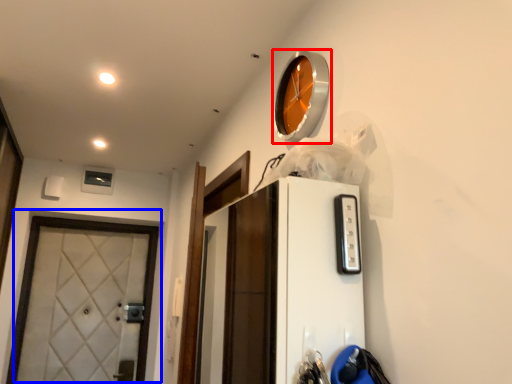
Question: Which point is closer to the camera, clock (highlighted by a red box) or door (highlighted by a blue box)?

Choices:
 (A) clock
 (B) door

Answer: (A)